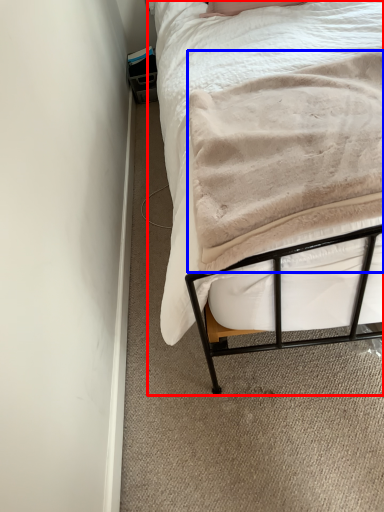
Question: Among these objects, which one is farthest to the camera, bed (highlighted by a red box) or blanket (highlighted by a blue box)?

Choices:
 (A) bed
 (B) blanket

Answer: (A)